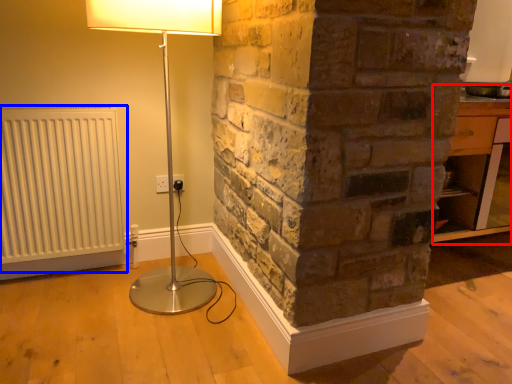
Question: Which object appears farthest to the camera in this image, table (highlighted by a red box) or radiator (highlighted by a blue box)?

Choices:
 (A) table
 (B) radiator

Answer: (A)